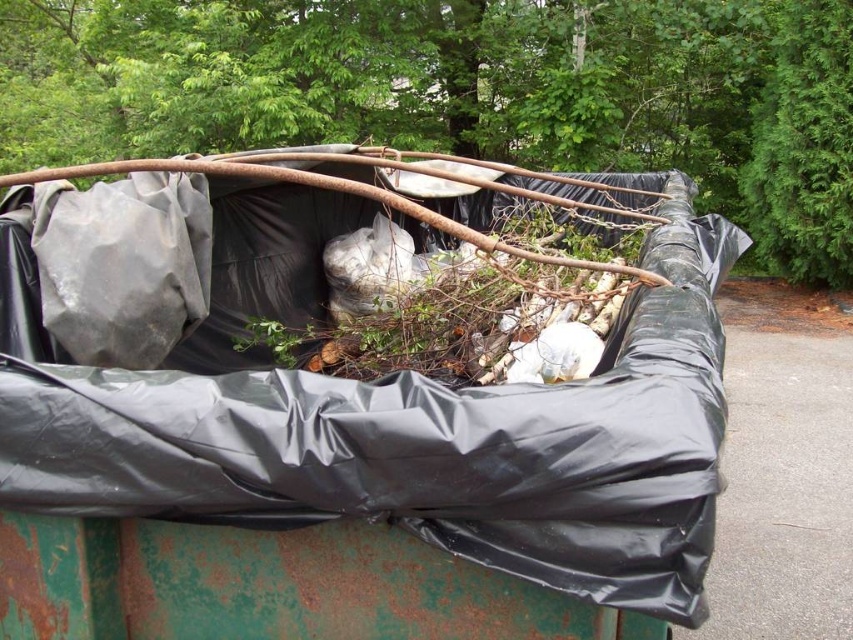
Who is positioned more to the right, black plastic bin at center or rusty metal tree at upper center?

From the viewer's perspective, black plastic bin at center appears more on the right side.

Does black plastic bin at center come in front of rusty metal tree at upper center?

That is True.

Which is behind, point (125, 387) or point (776, 131)?

The point (776, 131) is behind.

Where is `black plastic bin at center`? black plastic bin at center is located at coordinates (357, 445).